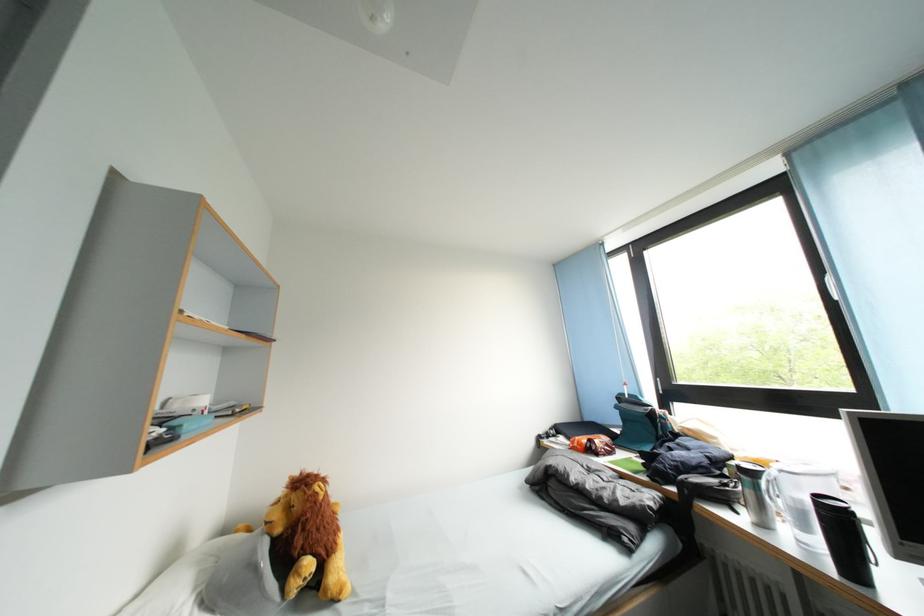
Describe the element at coordinates (847, 272) in the screenshot. I see `the blind pull handle` at that location.